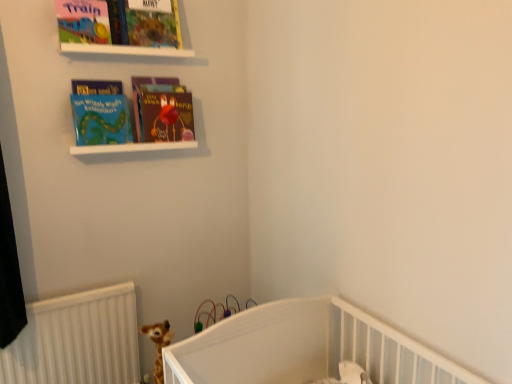
Image resolution: width=512 pixels, height=384 pixels. I want to click on vacant area on top of white matte shelf at upper center (from a real-world perspective), so click(x=130, y=134).